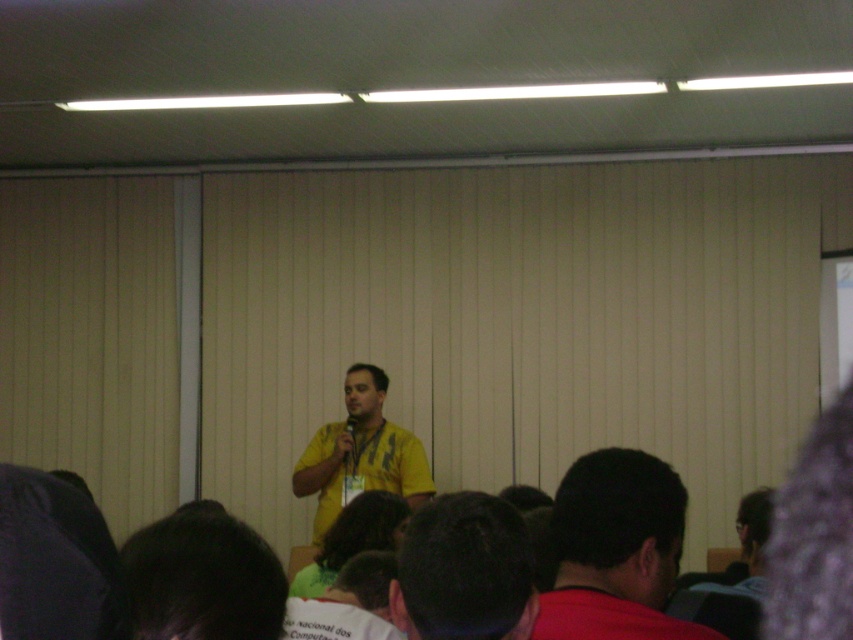
Does red matte shirt at center come in front of yellow shirt at center?

No, red matte shirt at center is further to the viewer.

Does red matte shirt at center appear under yellow shirt at center?

No.

Is point (587, 588) in front of point (506, 556)?

No, it is not.

This screenshot has height=640, width=853. What are the coordinates of `red matte shirt at center` in the screenshot? It's located at [616, 550].

Can you confirm if red matte shirt at center is positioned above yellow fabric shirt at center?

Yes.

Is point (619, 586) positioned before point (370, 376)?

Yes, it is in front of point (370, 376).

The image size is (853, 640). In order to click on red matte shirt at center in this screenshot , I will do `click(616, 550)`.

Does yellow shirt at center appear on the left side of yellow fabric shirt at center?

Incorrect, yellow shirt at center is not on the left side of yellow fabric shirt at center.

Between yellow shirt at center and yellow fabric shirt at center, which one is positioned lower?

Positioned lower is yellow fabric shirt at center.

Measure the distance between point (473,628) and camera.

They are 1.31 meters apart.

Where is `yellow shirt at center`? yellow shirt at center is located at coordinates click(463, 572).